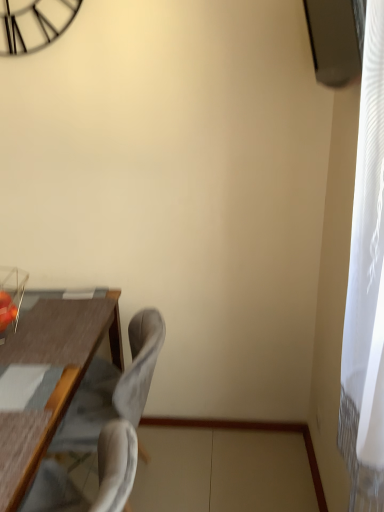
Question: In terms of width, does gray fabric swivel chair at lower left look wider or thinner when compared to suede-like gray chair at center-left?

Choices:
 (A) wide
 (B) thin

Answer: (B)

Question: Considering the relative positions of gray fabric swivel chair at lower left and suede-like gray chair at center-left in the image provided, is gray fabric swivel chair at lower left to the left or to the right of suede-like gray chair at center-left?

Choices:
 (A) left
 (B) right

Answer: (A)

Question: Considering the positions of gray fabric swivel chair at lower left and suede-like gray chair at center-left in the image, is gray fabric swivel chair at lower left bigger or smaller than suede-like gray chair at center-left?

Choices:
 (A) small
 (B) big

Answer: (A)

Question: In terms of width, does suede-like gray chair at center-left look wider or thinner when compared to gray fabric swivel chair at lower left?

Choices:
 (A) thin
 (B) wide

Answer: (B)

Question: In the image, is suede-like gray chair at center-left positioned in front of or behind gray fabric swivel chair at lower left?

Choices:
 (A) behind
 (B) front

Answer: (A)

Question: Is suede-like gray chair at center-left to the left or to the right of gray fabric swivel chair at lower left in the image?

Choices:
 (A) left
 (B) right

Answer: (B)

Question: Based on their sizes in the image, would you say suede-like gray chair at center-left is bigger or smaller than gray fabric swivel chair at lower left?

Choices:
 (A) big
 (B) small

Answer: (A)